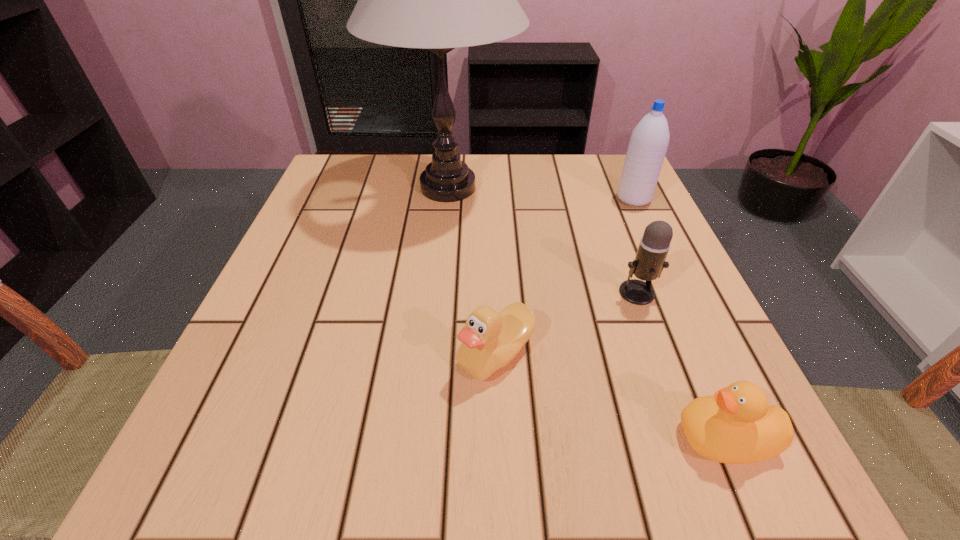
In order to click on lamp in this screenshot , I will do `click(438, 0)`.

Find the location of `the second tallest object`. the second tallest object is located at coordinates pyautogui.click(x=647, y=148).

Find the location of a particular element. The image size is (960, 540). the third nearest object is located at coordinates (649, 262).

What are the coordinates of `microphone` in the screenshot? It's located at (649, 262).

In order to click on the farther duck in this screenshot , I will do `click(490, 340)`.

At what (x,y) coordinates should I click in order to perform the action: click on the left duck. Please return your answer as a coordinate pair (x, y). This screenshot has height=540, width=960. Looking at the image, I should click on (490, 340).

Identify the location of the nearer duck. Image resolution: width=960 pixels, height=540 pixels. (736, 425).

At what (x,y) coordinates should I click in order to perform the action: click on the nearest object. Please return your answer as a coordinate pair (x, y). Looking at the image, I should click on (736, 425).

You are a GUI agent. You are given a task and a screenshot of the screen. Output one action in this format:
    pyautogui.click(x=<x>, y=<y>)
    Task: Click on the free region located on the left of the tallest object
    The height and width of the screenshot is (540, 960).
    Given the screenshot: What is the action you would take?
    pyautogui.click(x=325, y=187)

The image size is (960, 540). Identify the location of free location located on the front of the second tallest object. [x=644, y=222].